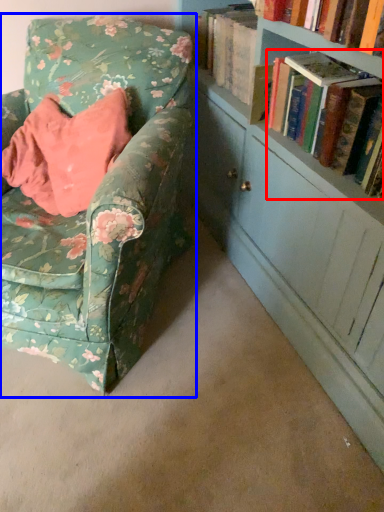
Question: Which point is further to the camera, book (highlighted by a red box) or chair (highlighted by a blue box)?

Choices:
 (A) book
 (B) chair

Answer: (A)